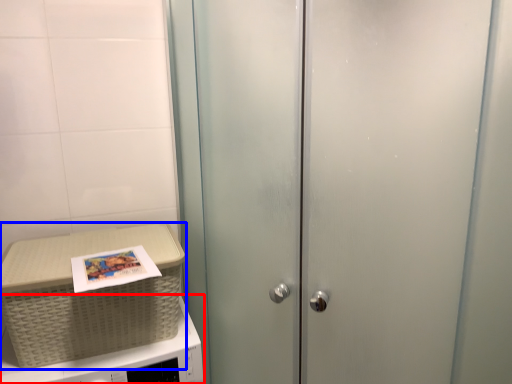
Question: Which object appears farthest to the camera in this image, microwave oven (highlighted by a red box) or picnic basket (highlighted by a blue box)?

Choices:
 (A) microwave oven
 (B) picnic basket

Answer: (B)